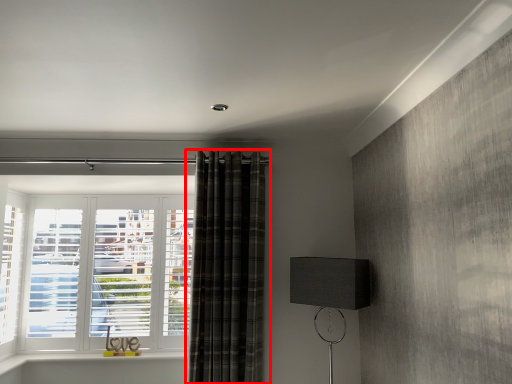
Question: From the image's perspective, where is curtain (annotated by the red box) located relative to table lamp?

Choices:
 (A) above
 (B) below

Answer: (A)